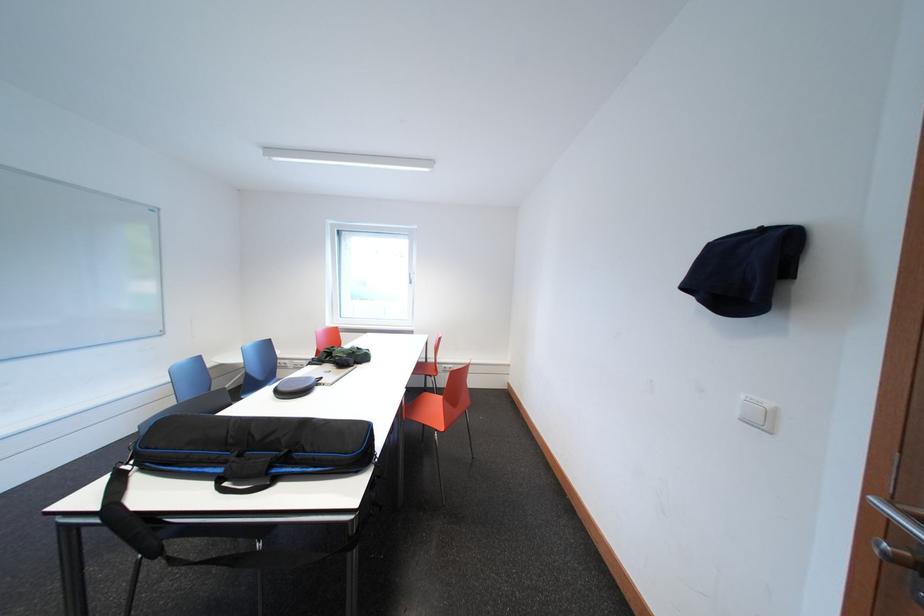
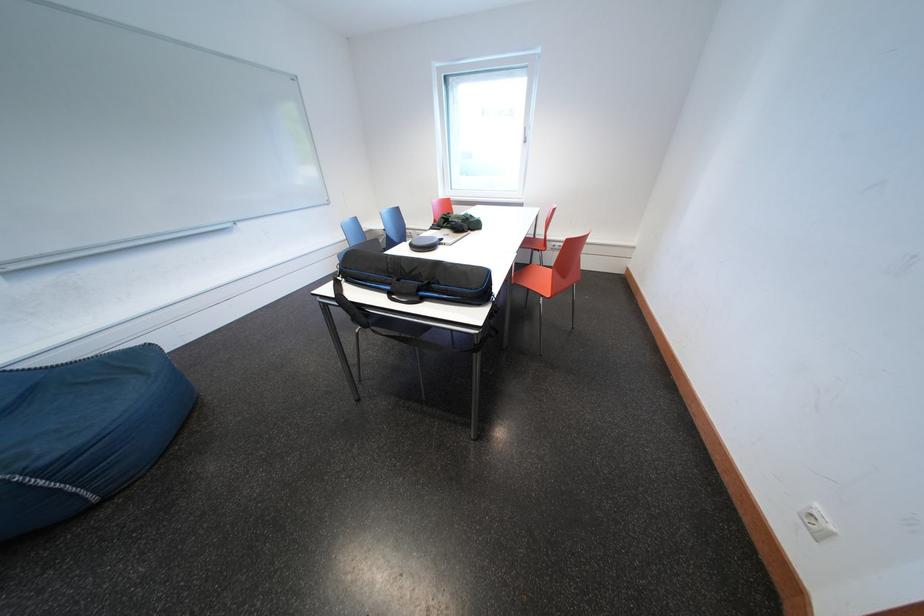
Locate, in the second image, the point that corresponds to (284,485) in the first image.

(431, 304)